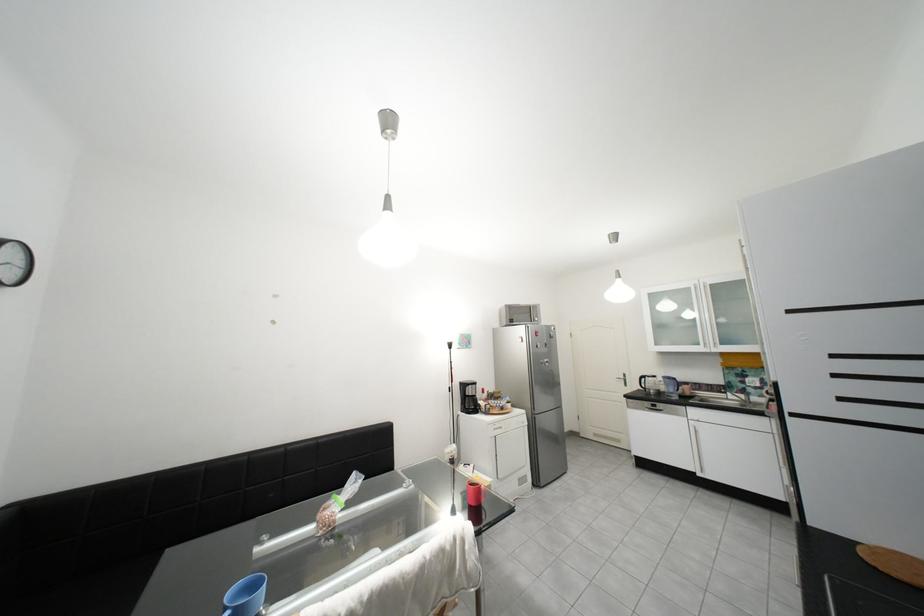
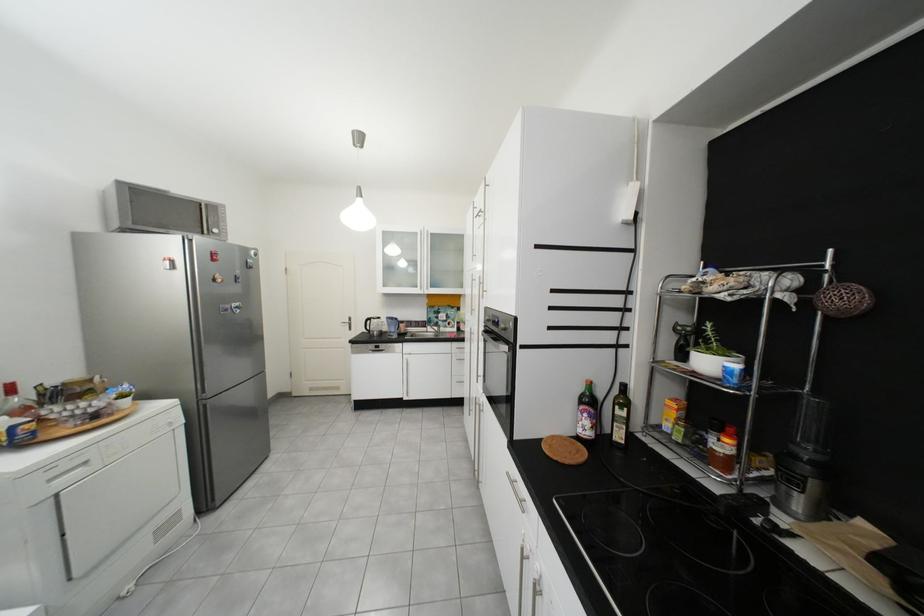
Find the pixel in the second image that matches pixel 533 342 in the first image.

(185, 269)